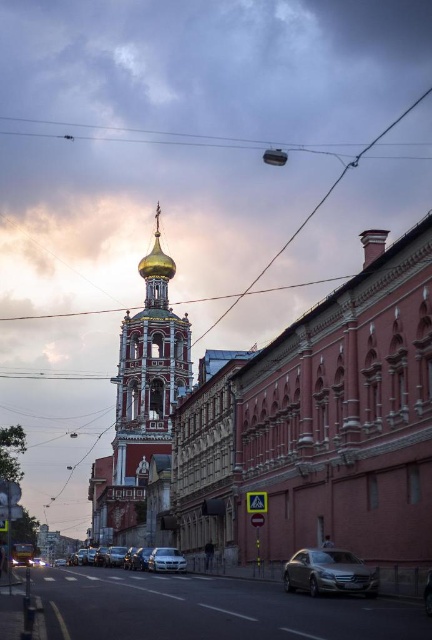
Consider the image. You are an architect analyzing the building heights in this street scene. Given that the gold domed church at upper left and the metallic wire at upper center are both visible in the distance, which one appears taller from your viewpoint?

The gold domed church at upper left appears taller than the metallic wire at upper center because it has a greater height compared to the metallic wire at upper center.

You are a photographer trying to capture the gold domed church at upper left and the metallic wire at upper center in the same frame. Based on their positions, which object would appear closer to the bottom of your photo?

The gold domed church at upper left is below metallic wire at upper center, so it would appear closer to the bottom of the photo.

You are standing on the street looking at the scene. There is a point marked at coordinates (320, 424). What does this point indicate?

The point at coordinates (320, 424) indicates the location of the gold domed church at upper left.